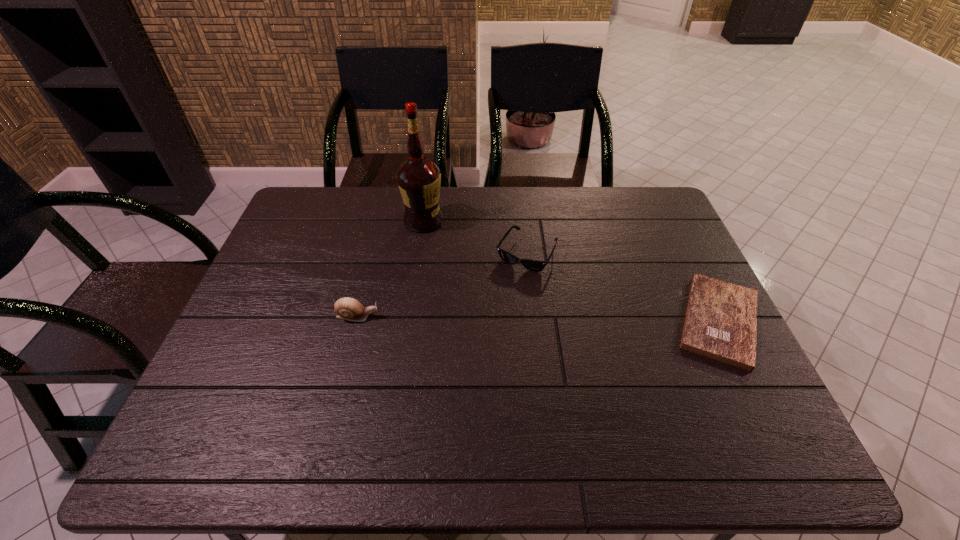
Identify the location of empty space that is in between the escargot and the sunglasses. This screenshot has width=960, height=540. (442, 285).

Where is `empty space between the third object from left to right and the shortest object`? empty space between the third object from left to right and the shortest object is located at coordinates (623, 287).

Where is `object that ranks as the third closest to the Bible`? The height and width of the screenshot is (540, 960). object that ranks as the third closest to the Bible is located at coordinates (347, 308).

Identify which object is the second nearest to the leftmost object. Please provide its 2D coordinates. Your answer should be formatted as a tuple, i.e. [(x, y)], where the tuple contains the x and y coordinates of a point satisfying the conditions above.

[(533, 265)]

Locate an element on the screen. This screenshot has width=960, height=540. vacant position in the image that satisfies the following two spatial constraints: 1. on the front side of the shortest object; 2. on the right side of the tallest object is located at coordinates (409, 321).